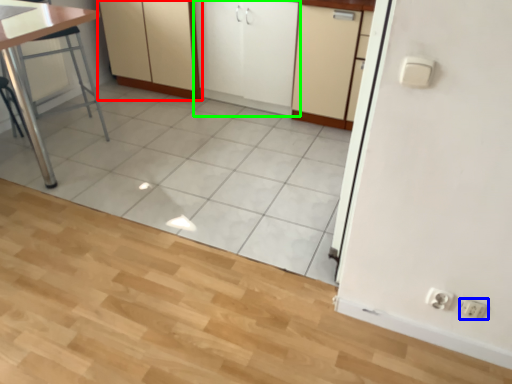
Question: Which object is the farthest from cabinetry (highlighted by a red box)? Choose among these: electric outlet (highlighted by a blue box) or cabinetry (highlighted by a green box).

Choices:
 (A) electric outlet
 (B) cabinetry

Answer: (A)